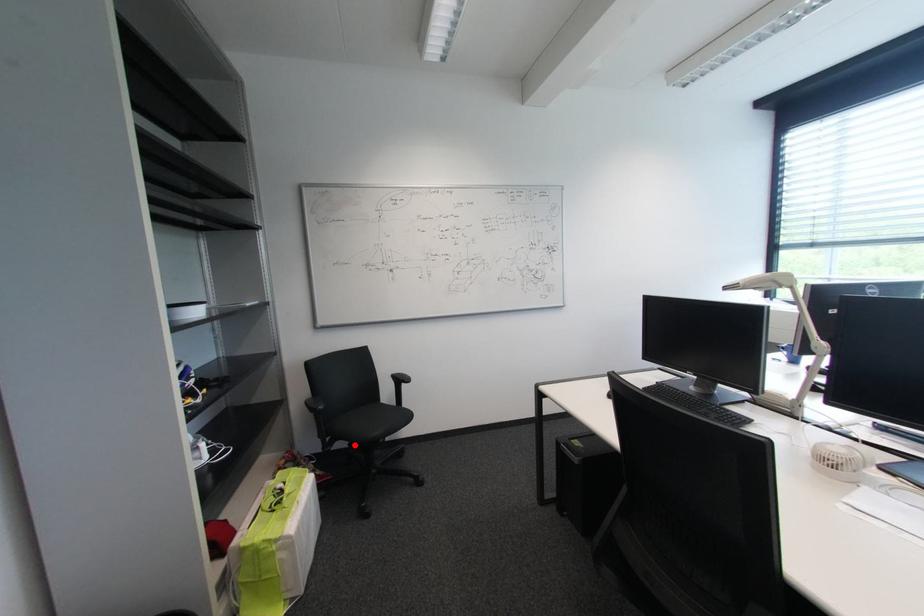
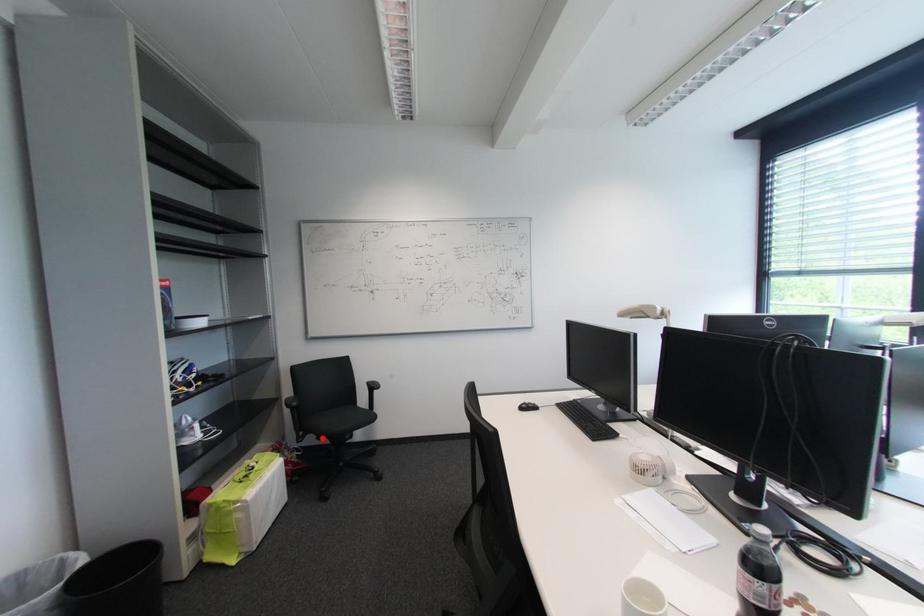
I am providing you with two images of the same scene from different viewpoints. A red point is marked on the first image and another point is marked on the second image. Are the points marked in image1 and image2 representing the same 3D position?

Yes